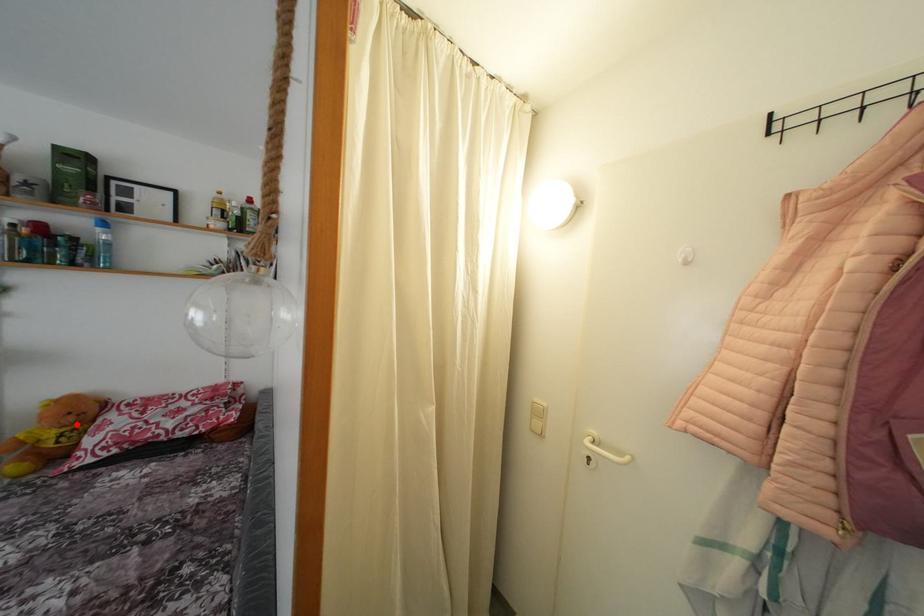
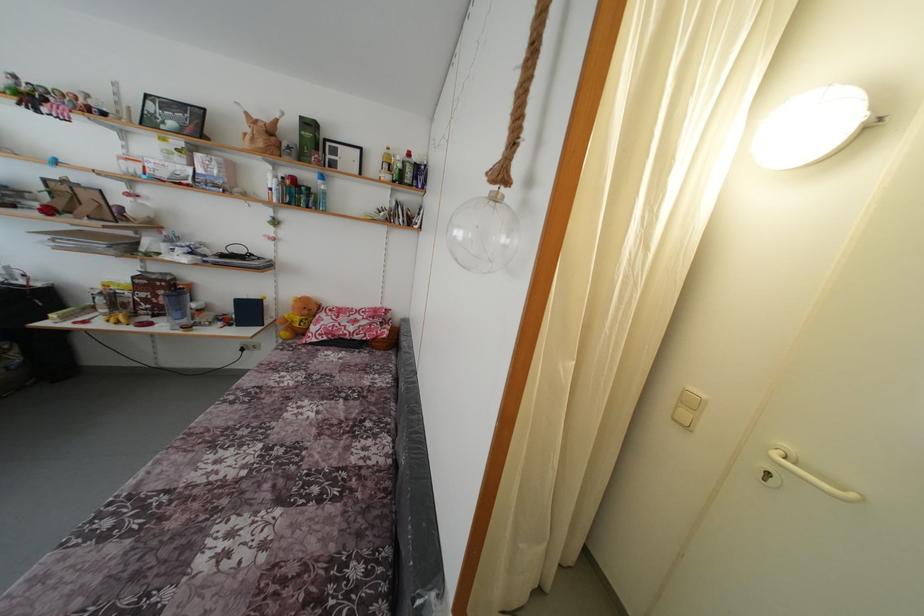
Locate, in the second image, the point that corresponds to the highlighted location in the first image.

(310, 317)